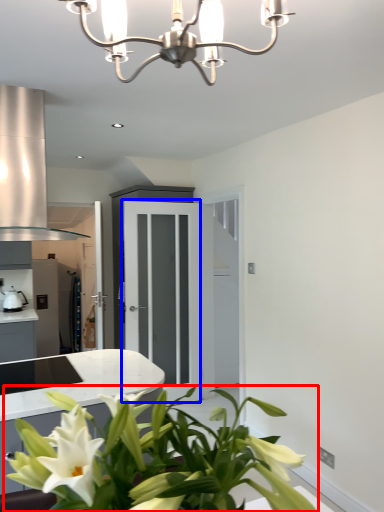
Question: Which point is closer to the camera, houseplant (highlighted by a red box) or glass door (highlighted by a blue box)?

Choices:
 (A) houseplant
 (B) glass door

Answer: (A)